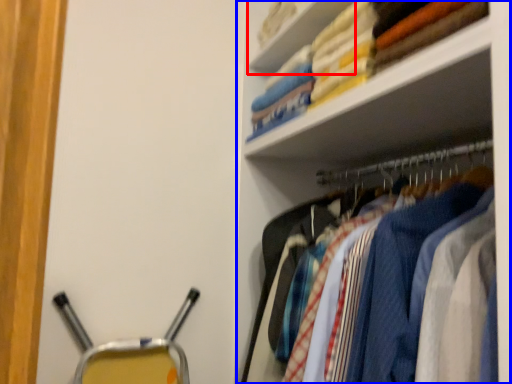
Question: Among these objects, which one is nearest to the camera, cabinet (highlighted by a red box) or shelf (highlighted by a blue box)?

Choices:
 (A) cabinet
 (B) shelf

Answer: (B)